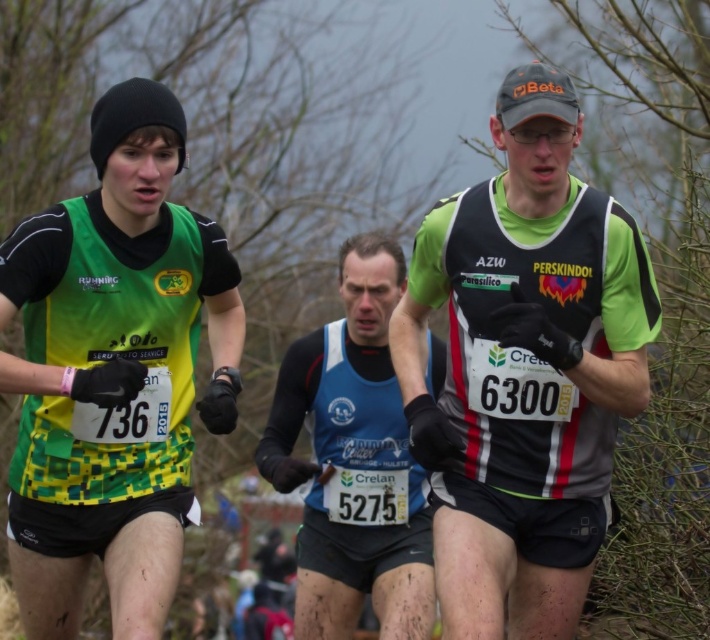
You are a race official observing the runners in the cross country race. You need to determine the position of the green jersey at center and blue fabric running vest at center. Which runner is ahead in the race?

The green jersey at center is to the right of the blue fabric running vest at center, so the green jersey at center is ahead in the race.